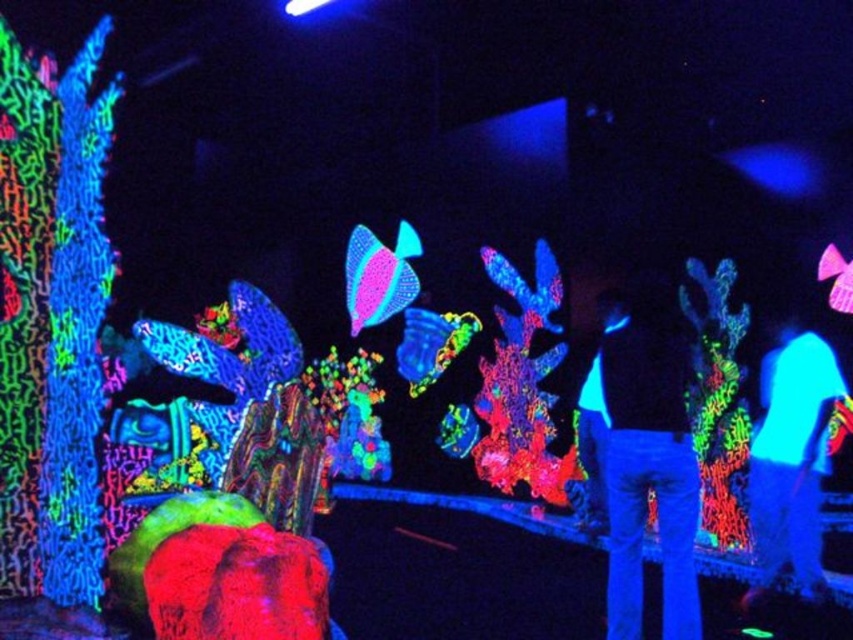
Is matte black jacket at center positioned at the back of neon blue fabric at center?

No, it is in front of neon blue fabric at center.

Can you confirm if matte black jacket at center is positioned below neon blue fabric at center?

Incorrect, matte black jacket at center is not positioned below neon blue fabric at center.

Does point (669, 442) come closer to viewer compared to point (788, 509)?

Yes, it is.

Locate an element on the screen. matte black jacket at center is located at coordinates (643, 465).